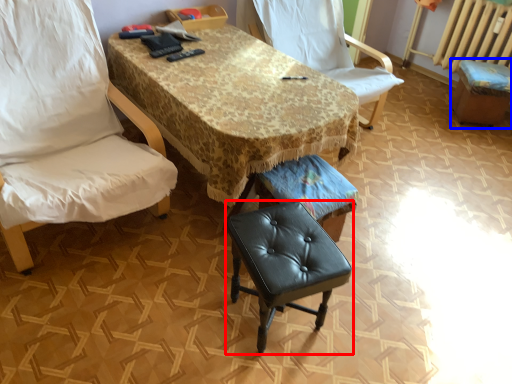
Question: Which object is further to the camera taking this photo, stool (highlighted by a red box) or bar stool (highlighted by a blue box)?

Choices:
 (A) stool
 (B) bar stool

Answer: (B)